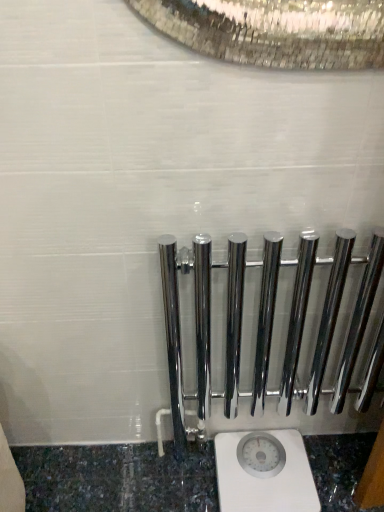
The width and height of the screenshot is (384, 512). What do you see at coordinates (264, 472) in the screenshot? I see `white plastic scale at lower center` at bounding box center [264, 472].

Find the location of a particular element. This screenshot has height=512, width=384. white plastic scale at lower center is located at coordinates (264, 472).

Image resolution: width=384 pixels, height=512 pixels. What are the coordinates of `polished chrome rail at center` in the screenshot? It's located at (269, 326).

What is the approximate width of polished chrome rail at center?

polished chrome rail at center is 9.40 centimeters in width.

Image resolution: width=384 pixels, height=512 pixels. Describe the element at coordinates (269, 326) in the screenshot. I see `polished chrome rail at center` at that location.

Locate an element on the screen. The height and width of the screenshot is (512, 384). white plastic scale at lower center is located at coordinates (264, 472).

From the picture: In the image, is white plastic scale at lower center on the left side or the right side of polished chrome rail at center?

In the image, white plastic scale at lower center appears on the left side of polished chrome rail at center.

Is white plastic scale at lower center behind polished chrome rail at center?

Yes, white plastic scale at lower center is behind polished chrome rail at center.

Which point is more forward, (283, 484) or (334, 298)?

The point (334, 298) is closer.

From the image's perspective, between white plastic scale at lower center and polished chrome rail at center, who is located below?

white plastic scale at lower center, from the image's perspective.

From a real-world perspective, is white plastic scale at lower center positioned above or below polished chrome rail at center?

white plastic scale at lower center is situated lower than polished chrome rail at center in the real world.

Considering the sizes of objects white plastic scale at lower center and polished chrome rail at center in the image provided, who is thinner, white plastic scale at lower center or polished chrome rail at center?

polished chrome rail at center is thinner.

Considering the relative sizes of white plastic scale at lower center and polished chrome rail at center in the image provided, is white plastic scale at lower center shorter than polished chrome rail at center?

Yes, white plastic scale at lower center is shorter than polished chrome rail at center.

In the scene shown: Considering the sizes of objects white plastic scale at lower center and polished chrome rail at center in the image provided, who is smaller, white plastic scale at lower center or polished chrome rail at center?

With smaller size is white plastic scale at lower center.

Is white plastic scale at lower center inside or outside of polished chrome rail at center?

white plastic scale at lower center lies outside polished chrome rail at center.

Can you see white plastic scale at lower center touching polished chrome rail at center?

white plastic scale at lower center and polished chrome rail at center are not in contact.

Looking at this image, is white plastic scale at lower center positioned with its back to polished chrome rail at center?

No, white plastic scale at lower center is not facing away from polished chrome rail at center.

How far apart are white plastic scale at lower center and polished chrome rail at center?

white plastic scale at lower center is 11.66 inches away from polished chrome rail at center.

Identify the location of rail lying above the white plastic scale at lower center (from the image's perspective). (269, 326).

Is polished chrome rail at center to the right of white plastic scale at lower center from the viewer's perspective?

Indeed, polished chrome rail at center is positioned on the right side of white plastic scale at lower center.

In the image, is polished chrome rail at center positioned in front of or behind white plastic scale at lower center?

Visually, polished chrome rail at center is located in front of white plastic scale at lower center.

Is point (225, 397) behind point (227, 479)?

Yes, it is.

From the image's perspective, between polished chrome rail at center and white plastic scale at lower center, who is located below?

white plastic scale at lower center, from the image's perspective.

From a real-world perspective, who is located higher, polished chrome rail at center or white plastic scale at lower center?

polished chrome rail at center.

Between polished chrome rail at center and white plastic scale at lower center, which one has smaller width?

polished chrome rail at center is thinner.

Is polished chrome rail at center taller than white plastic scale at lower center?

Yes, polished chrome rail at center is taller than white plastic scale at lower center.

Considering the relative sizes of polished chrome rail at center and white plastic scale at lower center in the image provided, is polished chrome rail at center bigger than white plastic scale at lower center?

Yes.

Would you say polished chrome rail at center is inside or outside white plastic scale at lower center?

polished chrome rail at center is located beyond the bounds of white plastic scale at lower center.

Is polished chrome rail at center positioned far away from white plastic scale at lower center?

No, polished chrome rail at center is in close proximity to white plastic scale at lower center.

Does polished chrome rail at center turn towards white plastic scale at lower center?

No, polished chrome rail at center is not facing towards white plastic scale at lower center.

From the picture: How different are the orientations of polished chrome rail at center and white plastic scale at lower center in degrees?

polished chrome rail at center and white plastic scale at lower center are facing 1.43 degrees away from each other.

The height and width of the screenshot is (512, 384). In order to click on toilet that is on the left side of polished chrome rail at center in this screenshot , I will do tap(264, 472).

You are a GUI agent. You are given a task and a screenshot of the screen. Output one action in this format:
    pyautogui.click(x=<x>, y=<y>)
    Task: Click on the toilet below the polished chrome rail at center (from the image's perspective)
    This screenshot has height=512, width=384.
    Given the screenshot: What is the action you would take?
    pyautogui.click(x=264, y=472)

Find the location of a particular element. Image resolution: width=384 pixels, height=512 pixels. toilet below the polished chrome rail at center (from a real-world perspective) is located at coordinates (264, 472).